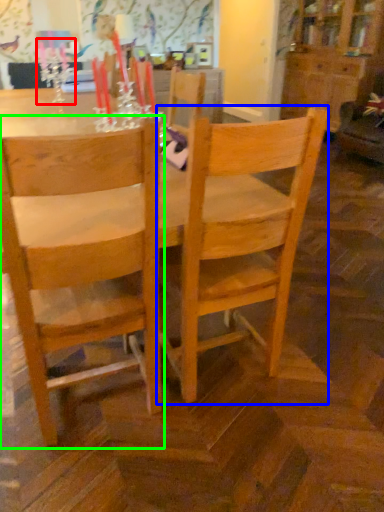
Question: Which object is the closest to the candle holder (highlighted by a red box)? Choose among these: chair (highlighted by a blue box) or chair (highlighted by a green box).

Choices:
 (A) chair
 (B) chair

Answer: (B)